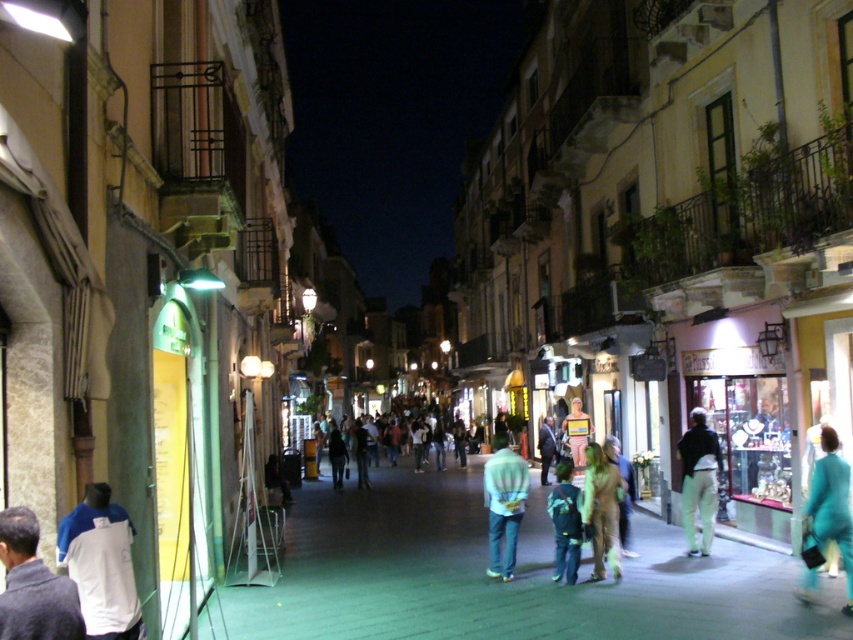
You are a fashion designer observing a street scene at night in a European city. You notice two items of clothing displayed on mannequins at the center of the image. The items are light blue denim jeans at center and green matte costume at center. Which clothing item appears taller?

The light blue denim jeans at center has a greater height compared to the green matte costume at center, so the light blue denim jeans at center appears taller.

You are a photographer standing in the middle of the street. You want to take a photo that includes both the teal fabric coat at lower right and the green matte costume at center. Which object should you focus on first to ensure both are in clear view?

You should focus on the teal fabric coat at lower right first because it is closer to the viewer than the green matte costume at center. By focusing on the closer object, you can ensure that both will be in focus if they are within the depth of field.

You are a photographer setting up a tripod in the middle of the street. You notice the light blue denim jeans at center and the green matte costume at center. Which object should you focus on to ensure it appears larger in your photo?

The light blue denim jeans at center is larger in size than the green matte costume at center, so focusing on the light blue denim jeans at center will ensure it appears larger in the photo.